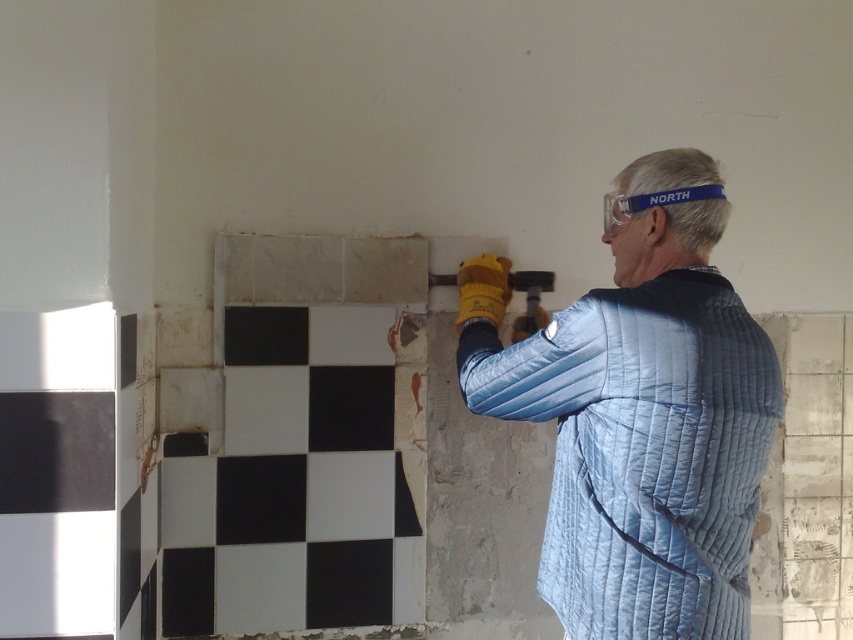
You are standing in the room and want to place a tool on the floor near the blue quilted jacket at center. Is the point at coordinates point (645, 419) the correct location to place the tool?

The blue quilted jacket at center is located at point (645, 419), so placing the tool there would place it near the jacket.

You are a contractor looking at the construction site in the image. You need to move the blue quilted jacket at center to the left side of the room. Which direction should you move it relative to the black matte tile at center?

The blue quilted jacket at center is currently to the right of the black matte tile at center. To move it to the left side of the room, you should move it to the left of the black matte tile at center.

You are a contractor assessing the renovation site. You see the blue quilted jacket at center and the black matte tile at center. Which object takes up more space in the scene?

The blue quilted jacket at center is larger in size than the black matte tile at center, so it takes up more space in the scene.